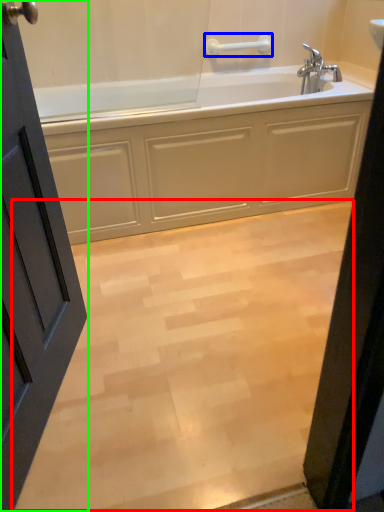
Question: Estimate the real-world distances between objects in this image. Which object is farther from plain (highlighted by a red box), towel bar (highlighted by a blue box) or door (highlighted by a green box)?

Choices:
 (A) towel bar
 (B) door

Answer: (A)